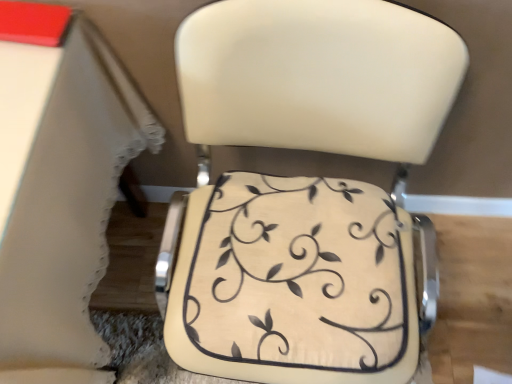
Question: Does matte cream cushion at center have a lesser width compared to white lace tablecloth at lower left?

Choices:
 (A) yes
 (B) no

Answer: (A)

Question: Considering the relative sizes of matte cream cushion at center and white lace tablecloth at lower left in the image provided, is matte cream cushion at center bigger than white lace tablecloth at lower left?

Choices:
 (A) yes
 (B) no

Answer: (B)

Question: From the image's perspective, is matte cream cushion at center over white lace tablecloth at lower left?

Choices:
 (A) no
 (B) yes

Answer: (A)

Question: Is there a large distance between matte cream cushion at center and white lace tablecloth at lower left?

Choices:
 (A) yes
 (B) no

Answer: (B)

Question: From the image's perspective, is matte cream cushion at center below white lace tablecloth at lower left?

Choices:
 (A) no
 (B) yes

Answer: (B)

Question: Is white lace tablecloth at lower left inside or outside of beige fabric cushion at center?

Choices:
 (A) outside
 (B) inside

Answer: (A)

Question: Looking at the image, does white lace tablecloth at lower left seem bigger or smaller compared to beige fabric cushion at center?

Choices:
 (A) small
 (B) big

Answer: (B)

Question: From a real-world perspective, is white lace tablecloth at lower left above or below beige fabric cushion at center?

Choices:
 (A) below
 (B) above

Answer: (A)

Question: Is point pos(36,99) positioned closer to the camera than point pos(203,271)?

Choices:
 (A) closer
 (B) farther

Answer: (A)

Question: Is matte cream cushion at center bigger or smaller than white lace tablecloth at lower left?

Choices:
 (A) big
 (B) small

Answer: (B)

Question: Would you say matte cream cushion at center is inside or outside white lace tablecloth at lower left?

Choices:
 (A) inside
 (B) outside

Answer: (B)

Question: Considering the positions of matte cream cushion at center and white lace tablecloth at lower left in the image, is matte cream cushion at center wider or thinner than white lace tablecloth at lower left?

Choices:
 (A) wide
 (B) thin

Answer: (B)

Question: From their relative heights in the image, would you say matte cream cushion at center is taller or shorter than white lace tablecloth at lower left?

Choices:
 (A) short
 (B) tall

Answer: (B)

Question: From the image's perspective, is beige fabric cushion at center positioned above or below matte cream cushion at center?

Choices:
 (A) above
 (B) below

Answer: (B)

Question: In the image, is beige fabric cushion at center on the left side or the right side of matte cream cushion at center?

Choices:
 (A) left
 (B) right

Answer: (A)